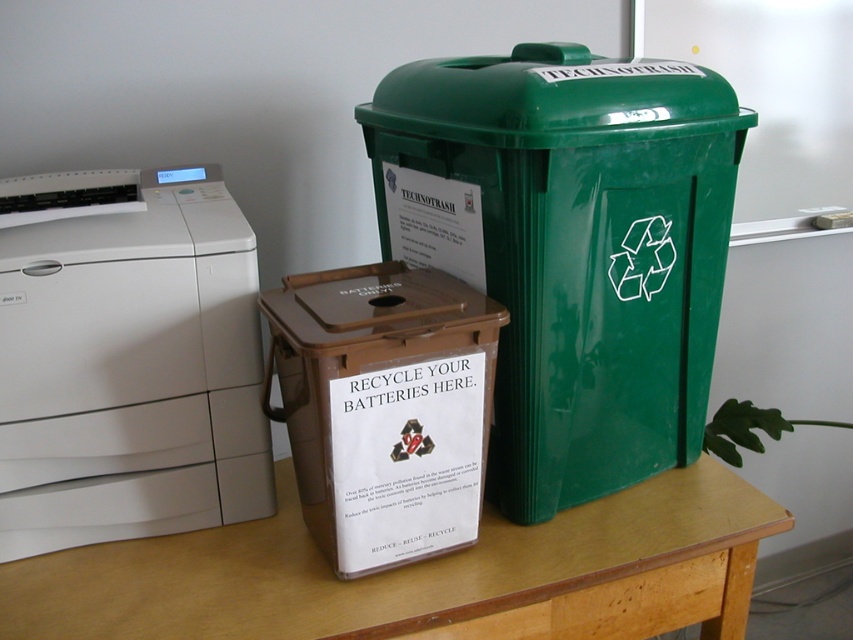
Can you confirm if white plastic printer at left is thinner than brown plastic box at center?

No.

What do you see at coordinates (126, 362) in the screenshot? The height and width of the screenshot is (640, 853). I see `white plastic printer at left` at bounding box center [126, 362].

Locate an element on the screen. white plastic printer at left is located at coordinates (126, 362).

Between light brown wood table at center and brown plastic box at center, which one is positioned higher?

brown plastic box at center

Can you confirm if light brown wood table at center is shorter than brown plastic box at center?

Yes, light brown wood table at center is shorter than brown plastic box at center.

Find the location of a particular element. The width and height of the screenshot is (853, 640). light brown wood table at center is located at coordinates (421, 576).

The height and width of the screenshot is (640, 853). Identify the location of light brown wood table at center. (421, 576).

The width and height of the screenshot is (853, 640). What do you see at coordinates (575, 248) in the screenshot? I see `green glossy plastic recycling bin at upper right` at bounding box center [575, 248].

Is point (508, 380) more distant than point (201, 465)?

No, it is in front of (201, 465).

Locate an element on the screen. This screenshot has height=640, width=853. green glossy plastic recycling bin at upper right is located at coordinates click(575, 248).